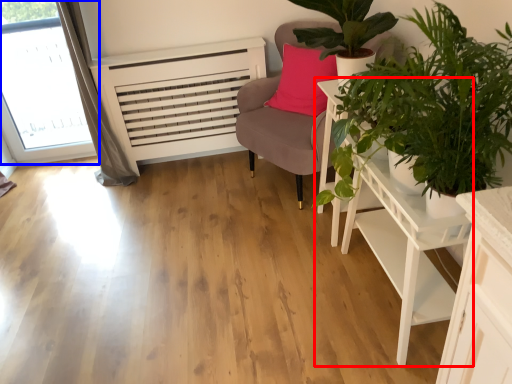
Question: Among these objects, which one is nearest to the camera, table (highlighted by a red box) or window (highlighted by a blue box)?

Choices:
 (A) table
 (B) window

Answer: (A)